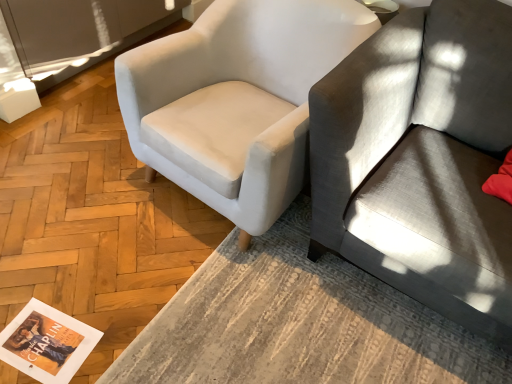
Question: Relative to textured gray rug at lower center, is white fabric chair at upper left in front or behind?

Choices:
 (A) front
 (B) behind

Answer: (B)

Question: Choose the correct answer: Is white fabric chair at upper left inside textured gray rug at lower center or outside it?

Choices:
 (A) inside
 (B) outside

Answer: (B)

Question: Considering the real-world distances, which object is farthest from the white fabric chair at upper left?

Choices:
 (A) gray fabric couch at right
 (B) matte paper magazine at lower left
 (C) textured gray rug at lower center

Answer: (B)

Question: Which object is the closest to the matte paper magazine at lower left?

Choices:
 (A) white fabric chair at upper left
 (B) textured gray rug at lower center
 (C) gray fabric couch at right

Answer: (B)